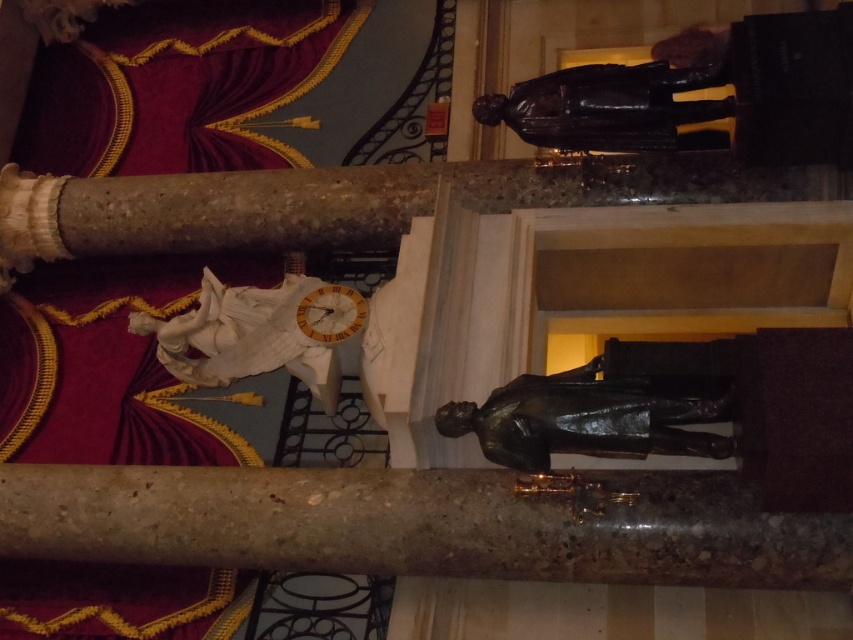
Between white marble statue at center and bronze statue at upper right, which one has more height?

white marble statue at center is taller.

Is white marble statue at center behind bronze statue at upper right?

That is True.

The height and width of the screenshot is (640, 853). Describe the element at coordinates (260, 332) in the screenshot. I see `white marble statue at center` at that location.

Image resolution: width=853 pixels, height=640 pixels. I want to click on white marble statue at center, so click(260, 332).

This screenshot has width=853, height=640. I want to click on bronze statue at center, so click(x=595, y=417).

How far apart are bronze statue at center and white marble statue at center?

bronze statue at center is 1.68 meters away from white marble statue at center.

Who is more distant from viewer, (688,444) or (221,284)?

Point (221,284)

You are a GUI agent. You are given a task and a screenshot of the screen. Output one action in this format:
    pyautogui.click(x=<x>, y=<y>)
    Task: Click on the bronze statue at center
    
    Given the screenshot: What is the action you would take?
    pyautogui.click(x=595, y=417)

In the scene shown: Is the position of bronze statue at center more distant than that of bronze statue at upper right?

No, it is in front of bronze statue at upper right.

Is bronze statue at center above bronze statue at upper right?

Actually, bronze statue at center is below bronze statue at upper right.

The height and width of the screenshot is (640, 853). What do you see at coordinates (595, 417) in the screenshot?
I see `bronze statue at center` at bounding box center [595, 417].

Image resolution: width=853 pixels, height=640 pixels. Find the location of `bronze statue at center`. bronze statue at center is located at coordinates (595, 417).